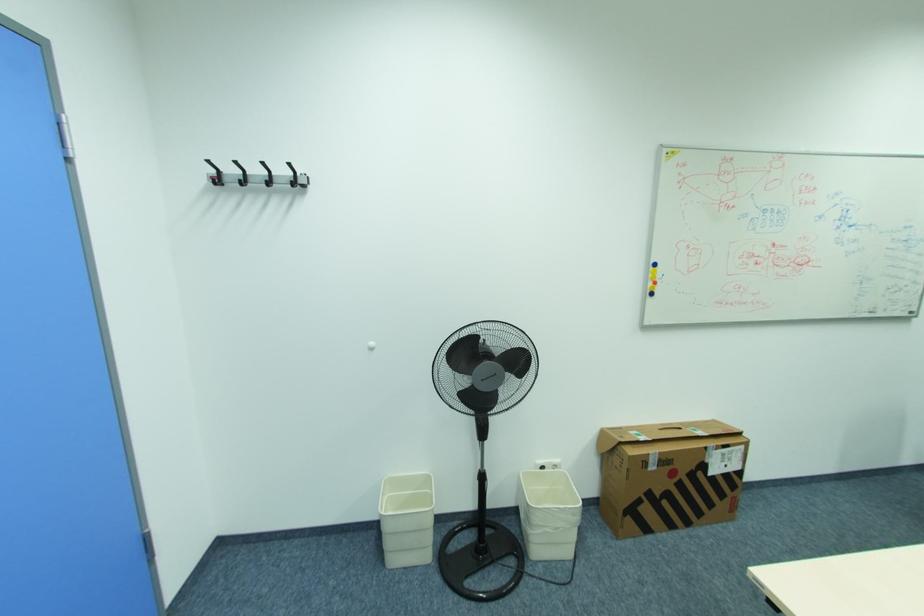
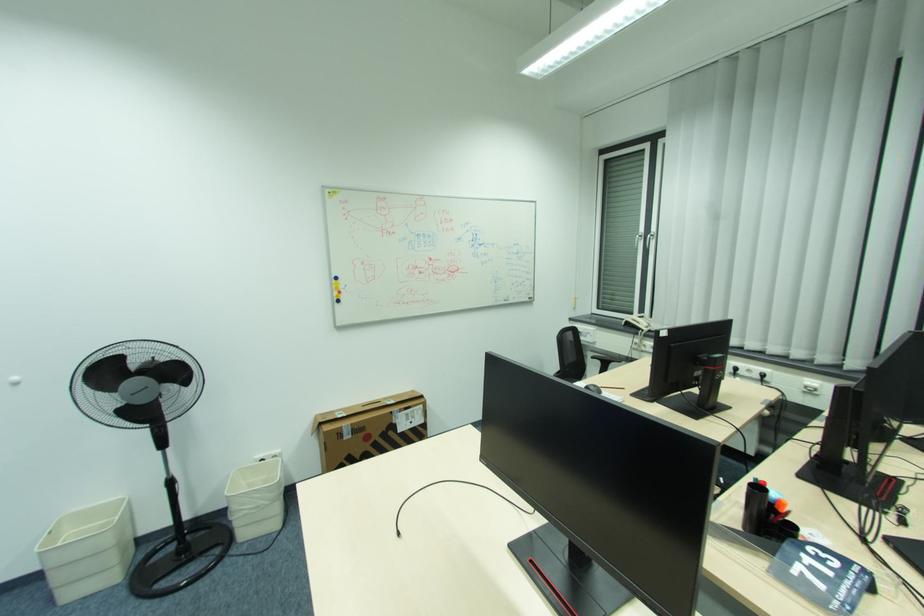
Where in the second image is the point corresponding to pixel 483 469 from the first image?

(169, 477)